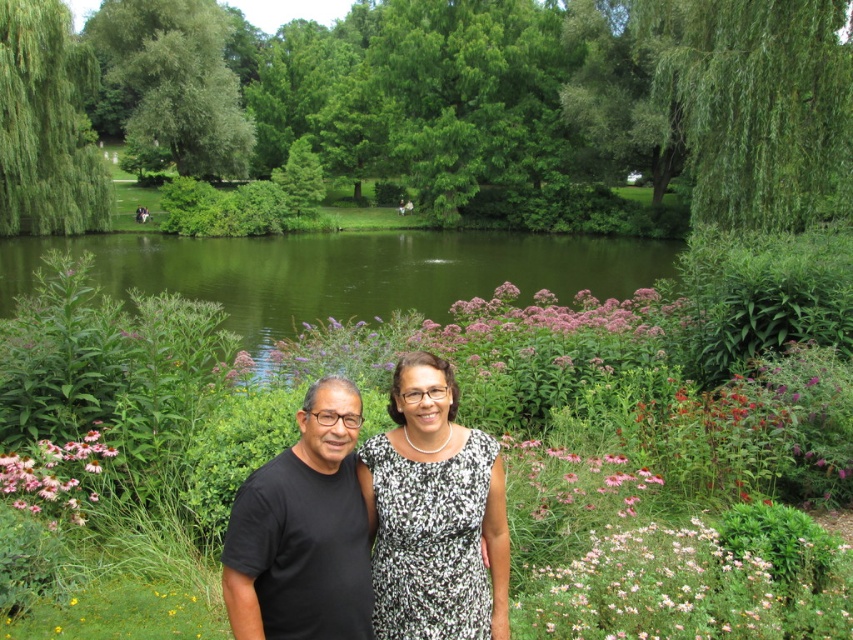
Does green smooth water at center appear over black matte t-shirt at center?

Yes.

Between point (370, 259) and point (302, 630), which one is positioned behind?

Positioned behind is point (370, 259).

Find the location of a particular element. The image size is (853, 640). green smooth water at center is located at coordinates (344, 272).

Who is lower down, black printed dress at center or pink matte flower at center?

pink matte flower at center is lower down.

Between black printed dress at center and pink matte flower at center, which one has more height?

Standing taller between the two is black printed dress at center.

Who is more distant from viewer, (x=479, y=490) or (x=33, y=464)?

Positioned behind is point (x=33, y=464).

Identify the location of black printed dress at center. (434, 513).

In the scene shown: Which of these two, black matte t-shirt at center or pink matte flower at lower center, stands taller?

Standing taller between the two is black matte t-shirt at center.

Can you confirm if black matte t-shirt at center is smaller than pink matte flower at lower center?

Yes.

Between point (337, 422) and point (538, 442), which one is positioned behind?

Positioned behind is point (538, 442).

At what (x,y) coordinates should I click in order to perform the action: click on black matte t-shirt at center. Please return your answer as a coordinate pair (x, y). The image size is (853, 640). Looking at the image, I should click on (303, 531).